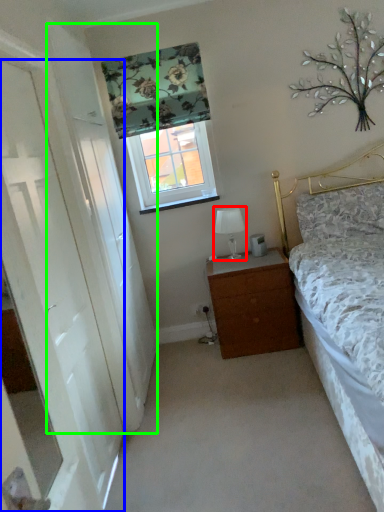
Question: Which object is the closest to the table lamp (highlighted by a red box)? Choose among these: door (highlighted by a blue box) or screen door (highlighted by a green box).

Choices:
 (A) door
 (B) screen door

Answer: (B)